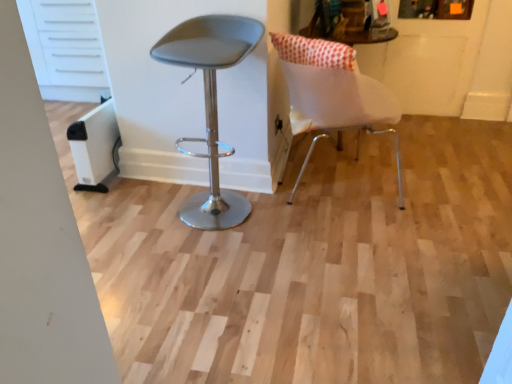
Question: From a real-world perspective, is white matte chair at right, acting as the 2th chair starting from the left, positioned under white fabric cushion at upper right based on gravity?

Choices:
 (A) no
 (B) yes

Answer: (B)

Question: Could white fabric cushion at upper right be considered to be inside white matte chair at right, the 1th chair when ordered from right to left?

Choices:
 (A) yes
 (B) no

Answer: (A)

Question: Considering the relative positions of white matte chair at right, the 1th chair when ordered from right to left, and white fabric cushion at upper right in the image provided, is white matte chair at right, the 1th chair when ordered from right to left, to the left of white fabric cushion at upper right from the viewer's perspective?

Choices:
 (A) yes
 (B) no

Answer: (B)

Question: Can you confirm if white matte chair at right, acting as the 2th chair starting from the left, is positioned to the right of white fabric cushion at upper right?

Choices:
 (A) yes
 (B) no

Answer: (A)

Question: Is white matte chair at right, the 1th chair when ordered from right to left, oriented towards white fabric cushion at upper right?

Choices:
 (A) no
 (B) yes

Answer: (A)

Question: Is white matte chair at right, acting as the 2th chair starting from the left, situated inside white fabric cushion at upper right or outside?

Choices:
 (A) inside
 (B) outside

Answer: (B)

Question: Considering the positions of white matte chair at right, the 1th chair when ordered from right to left, and white fabric cushion at upper right in the image, is white matte chair at right, the 1th chair when ordered from right to left, bigger or smaller than white fabric cushion at upper right?

Choices:
 (A) big
 (B) small

Answer: (A)

Question: From their relative heights in the image, would you say white matte chair at right, the 1th chair when ordered from right to left, is taller or shorter than white fabric cushion at upper right?

Choices:
 (A) short
 (B) tall

Answer: (B)

Question: Relative to white fabric cushion at upper right, is white matte chair at right, the 1th chair when ordered from right to left, in front or behind?

Choices:
 (A) front
 (B) behind

Answer: (B)

Question: In terms of height, does white fabric cushion at upper right look taller or shorter compared to matte gray stool at center, the second chair from the right?

Choices:
 (A) short
 (B) tall

Answer: (A)

Question: Based on their sizes in the image, would you say white fabric cushion at upper right is bigger or smaller than matte gray stool at center, the second chair from the right?

Choices:
 (A) big
 (B) small

Answer: (B)

Question: Is white fabric cushion at upper right to the left or to the right of matte gray stool at center, which is the first chair in left-to-right order, in the image?

Choices:
 (A) right
 (B) left

Answer: (A)

Question: Is point (307, 28) positioned closer to the camera than point (233, 190)?

Choices:
 (A) farther
 (B) closer

Answer: (A)

Question: From the image's perspective, relative to matte gray stool at center, which is the first chair in left-to-right order, is white matte chair at right, the 1th chair when ordered from right to left, above or below?

Choices:
 (A) above
 (B) below

Answer: (A)

Question: Does point (332, 52) appear closer or farther from the camera than point (214, 124)?

Choices:
 (A) closer
 (B) farther

Answer: (A)